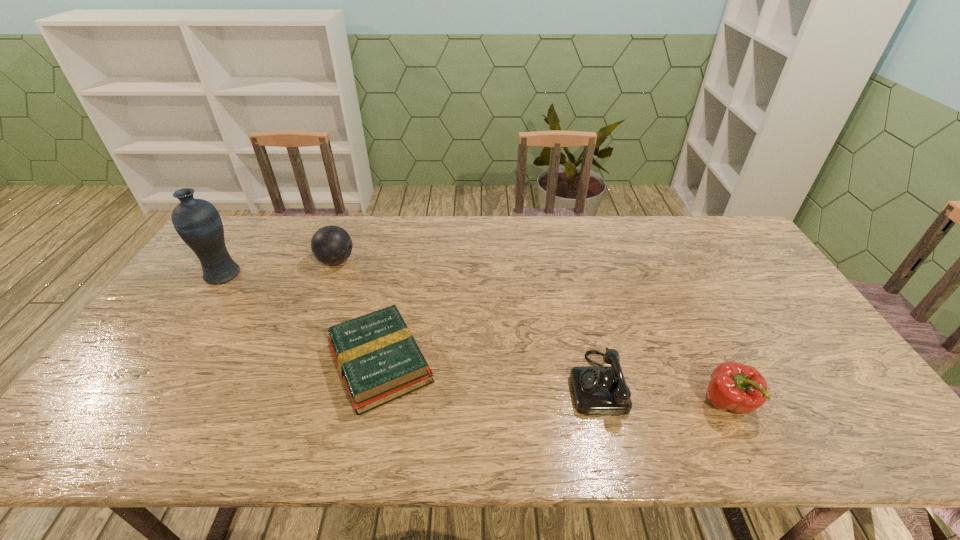
Identify the location of vase. (197, 221).

At what (x,y) coordinates should I click in order to perform the action: click on the leftmost object. Please return your answer as a coordinate pair (x, y). This screenshot has height=540, width=960. Looking at the image, I should click on (197, 221).

You are a GUI agent. You are given a task and a screenshot of the screen. Output one action in this format:
    pyautogui.click(x=<x>, y=<y>)
    Task: Click on the fourth object from right to left
    The height and width of the screenshot is (540, 960).
    Given the screenshot: What is the action you would take?
    pyautogui.click(x=331, y=245)

The width and height of the screenshot is (960, 540). I want to click on the rightmost object, so click(x=740, y=388).

Locate an element on the screen. This screenshot has height=540, width=960. the second shortest object is located at coordinates (597, 390).

Find the location of a particular element. This screenshot has height=540, width=960. telephone is located at coordinates (597, 390).

I want to click on hardback book, so click(x=378, y=359).

In order to click on the third object from left to right in this screenshot , I will do pos(378,359).

This screenshot has width=960, height=540. I want to click on free space located on the right of the tallest object, so click(x=307, y=274).

Identify the location of free space located 0.100m on the grip area of the fourth object from right to left. (386, 261).